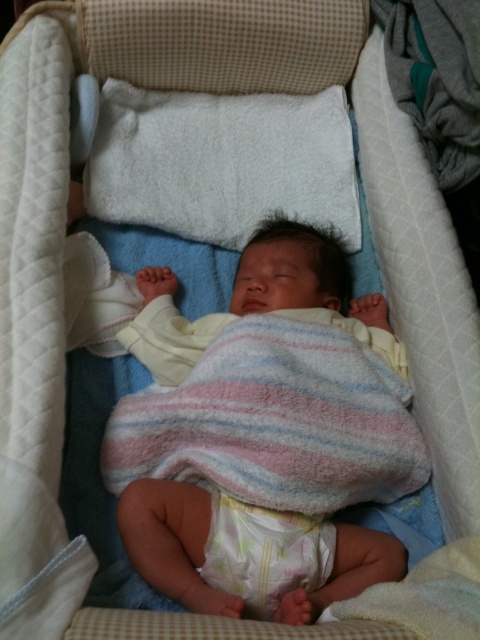
You are a nurse checking on a newborn baby in the bassinet. You see the soft cotton blanket at center and the white soft diaper at center. Which item is located to the right of the other?

The soft cotton blanket at center is positioned on the right side of the white soft diaper at center.

You are a nurse checking on a newborn in the bassinet. You need to ensure the baby is not too warm. Which item is higher up and might be covering the baby more, the soft cotton blanket at center or the white soft diaper at center?

The soft cotton blanket at center is taller than the white soft diaper at center, so it is higher up and might be covering the baby more.